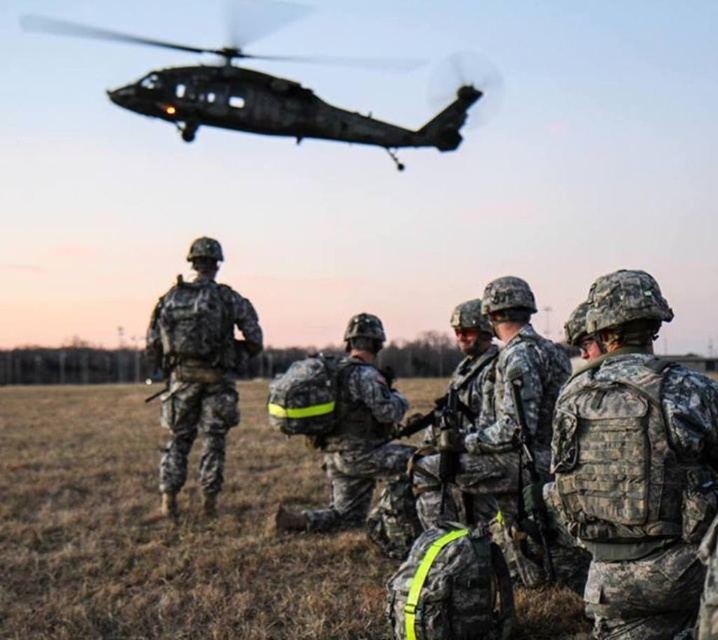
Can you confirm if camouflage fabric vest at center is bigger than camouflage uniform at center?

Actually, camouflage fabric vest at center might be smaller than camouflage uniform at center.

Which is more to the left, camouflage fabric vest at center or camouflage uniform at center?

camouflage uniform at center

What are the coordinates of `camouflage fabric vest at center` in the screenshot? It's located at (634, 465).

Where is `camouflage fabric vest at center`? camouflage fabric vest at center is located at coordinates (634, 465).

Is point (582, 545) in front of point (242, 33)?

Yes, point (582, 545) is in front of point (242, 33).

Which is more to the left, camouflage fabric vest at center or black matte helicopter at upper left?

black matte helicopter at upper left is more to the left.

The width and height of the screenshot is (718, 640). What do you see at coordinates (634, 465) in the screenshot? I see `camouflage fabric vest at center` at bounding box center [634, 465].

You are a GUI agent. You are given a task and a screenshot of the screen. Output one action in this format:
    pyautogui.click(x=<x>, y=<y>)
    Task: Click on the camouflage fabric vest at center
    
    Given the screenshot: What is the action you would take?
    click(634, 465)

Between point (265, 116) and point (381, 460), which one is positioned behind?

Positioned behind is point (265, 116).

What do you see at coordinates (261, 88) in the screenshot? The image size is (718, 640). I see `black matte helicopter at upper left` at bounding box center [261, 88].

Does point (248, 132) come farther from viewer compared to point (342, 390)?

Yes.

Find the location of a particular element. black matte helicopter at upper left is located at coordinates (261, 88).